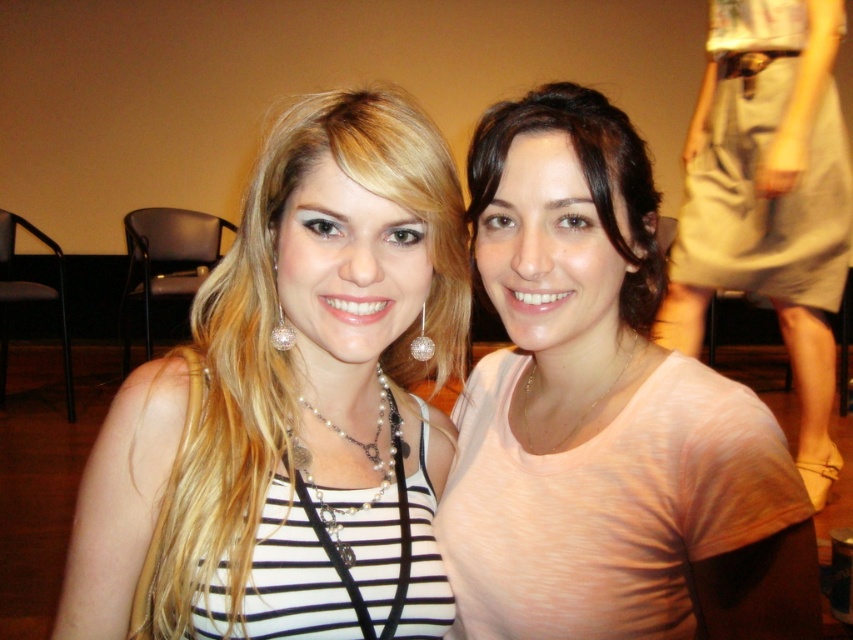
Question: Estimate the real-world distances between objects in this image. Which object is closer to the khaki cotton shorts at right?

Choices:
 (A) pearl/chain necklace at center
 (B) pink matte shirt at center
 (C) pearl/pearly chain at center
 (D) gold chain necklace at center

Answer: (B)

Question: Does matte peach shirt at center have a greater width compared to pearl/chain necklace at center?

Choices:
 (A) yes
 (B) no

Answer: (A)

Question: Which is farther from the matte peach shirt at center?

Choices:
 (A) khaki cotton shorts at right
 (B) matte black top at center
 (C) gold chain necklace at center

Answer: (A)

Question: Does khaki cotton shorts at right have a larger size compared to pearl/pearly chain at center?

Choices:
 (A) no
 (B) yes

Answer: (B)

Question: Among these points, which one is nearest to the camera?

Choices:
 (A) (598, 180)
 (B) (370, 288)

Answer: (B)

Question: Is pink matte shirt at center positioned at the back of khaki cotton shorts at right?

Choices:
 (A) yes
 (B) no

Answer: (B)